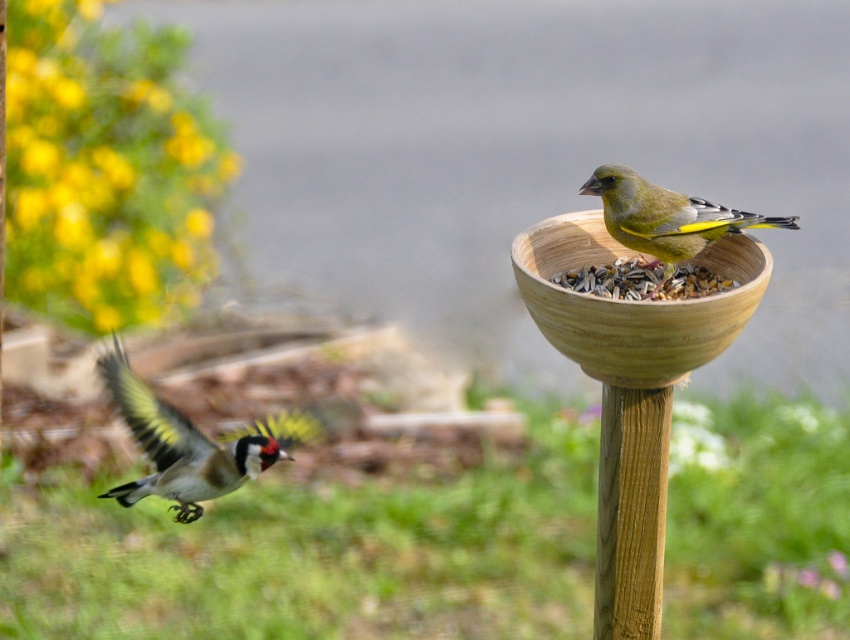
Between wooden bowl at upper right and yellow-green feathers at upper right, which one is positioned lower?

wooden bowl at upper right

Does point (650, 352) come closer to viewer compared to point (709, 208)?

Yes.

Identify the location of wooden bowl at upper right. (632, 388).

Is yellow-green feathers at upper right positioned behind brown wooden bowl at upper right?

Yes.

Identify the location of yellow-green feathers at upper right. (666, 218).

The height and width of the screenshot is (640, 850). Find the location of `yellow-green feathers at upper right`. yellow-green feathers at upper right is located at coordinates (666, 218).

Between speckled feathered bird at left and yellow-green feathers at upper right, which one is positioned higher?

yellow-green feathers at upper right is higher up.

Describe the element at coordinates (191, 444) in the screenshot. I see `speckled feathered bird at left` at that location.

This screenshot has width=850, height=640. Find the location of `speckled feathered bird at left`. speckled feathered bird at left is located at coordinates (191, 444).